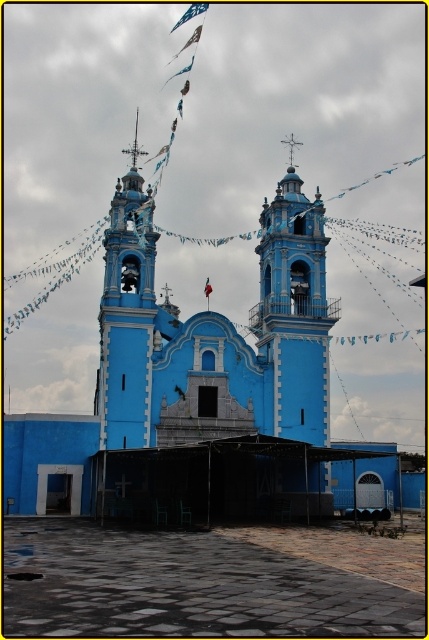
You are standing in front of the blue painted stone church at center and the matte blue bell tower at center. Which structure is taller?

The blue painted stone church at center is much taller than the matte blue bell tower at center.

You are standing at the entrance of the blue painted stone church at center. If you walk straight ahead, will you immediately exit the paved area in front of the church?

The blue painted stone church at center is positioned at point (x=187, y=355), so walking straight ahead from the entrance may or may not exit the paved area immediately depending on the paved area boundaries not specified here.